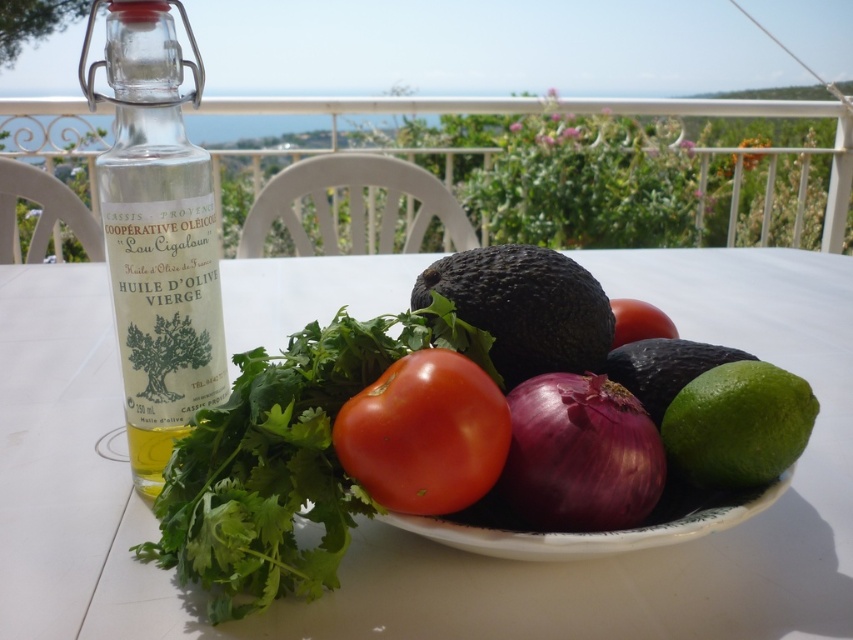
Is red smooth tomato at center positioned behind green matte avocado at lower right?

No.

This screenshot has height=640, width=853. I want to click on red smooth tomato at center, so [x=283, y=460].

Locate an element on the screen. The image size is (853, 640). red smooth tomato at center is located at coordinates (283, 460).

Find the location of a particular element. red smooth tomato at center is located at coordinates (283, 460).

Is point (152, 390) farther from viewer compared to point (640, 333)?

That is False.

Image resolution: width=853 pixels, height=640 pixels. Find the location of `clear glass bottle at left`. clear glass bottle at left is located at coordinates (155, 230).

What do you see at coordinates (155, 230) in the screenshot?
I see `clear glass bottle at left` at bounding box center [155, 230].

Identify the location of clear glass bottle at left. (155, 230).

Find the location of a particular element. Image resolution: width=853 pixels, height=640 pixels. white glossy table at center is located at coordinates (416, 536).

Does white glossy table at center have a lesser height compared to red matte tomato at center?

Incorrect, white glossy table at center's height does not fall short of red matte tomato at center's.

Between point (730, 554) and point (662, 317), which one is positioned behind?

Positioned behind is point (662, 317).

This screenshot has width=853, height=640. What are the coordinates of `white glossy table at center` in the screenshot? It's located at (416, 536).